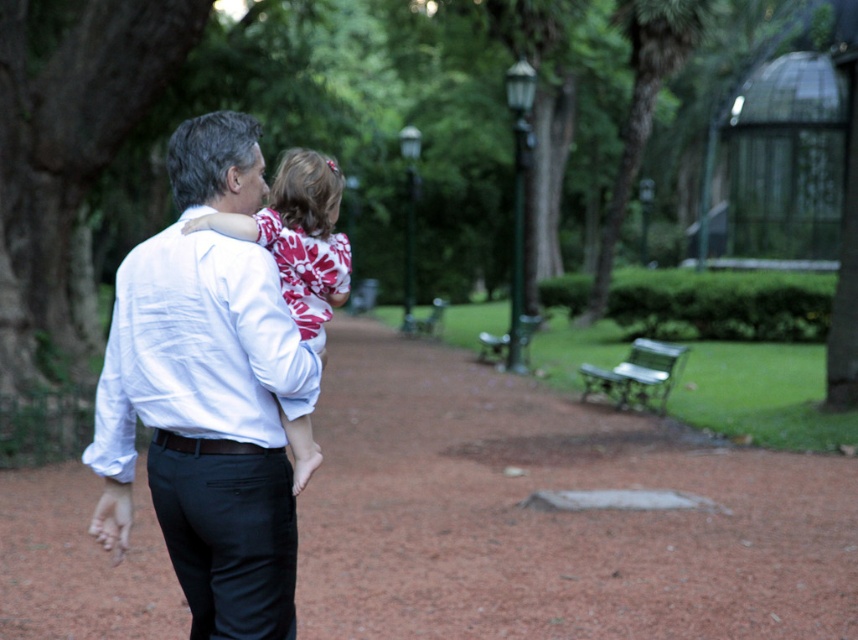
Question: Does white cotton shirt at center appear over white tie-dye shirt at center?

Choices:
 (A) no
 (B) yes

Answer: (A)

Question: Among these objects, which one is farthest from the camera?

Choices:
 (A) smooth dirt path at center
 (B) white tie-dye shirt at center
 (C) green wooden bench at center

Answer: (C)

Question: Is the position of green metal bench at lower right less distant than that of green wooden bench at center?

Choices:
 (A) no
 (B) yes

Answer: (B)

Question: Which point is closer to the camera?

Choices:
 (A) smooth dirt path at center
 (B) green wooden bench at center
 (C) white tie-dye shirt at center

Answer: (A)

Question: Which point appears farthest from the camera in this image?

Choices:
 (A) (408, 436)
 (B) (176, 490)
 (C) (530, 316)

Answer: (C)

Question: Does white tie-dye shirt at center appear under green wooden bench at center?

Choices:
 (A) no
 (B) yes

Answer: (B)